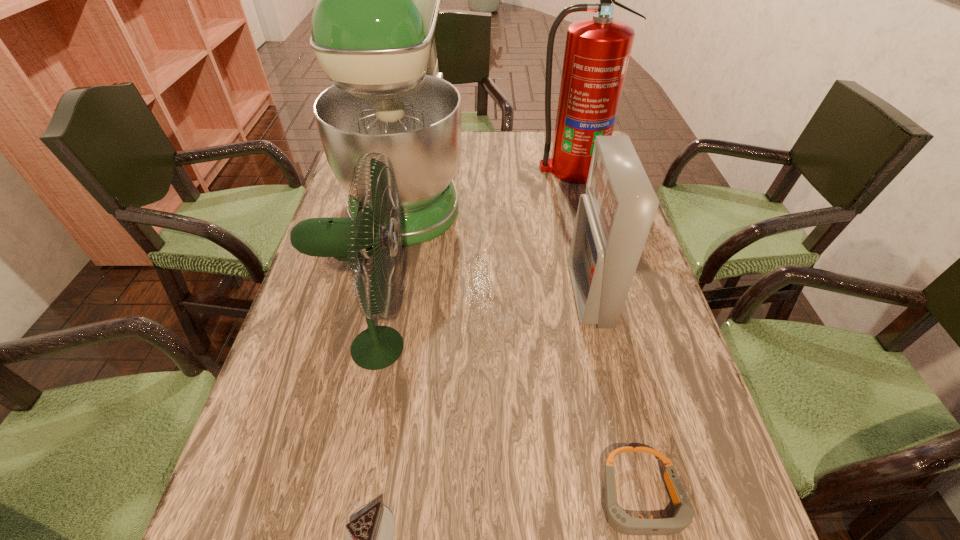
Locate an element on the screen. Image resolution: width=960 pixels, height=540 pixels. mixer that is positioned at the far edge is located at coordinates [373, 26].

This screenshot has width=960, height=540. What are the coordinates of `fire extinguisher that is at the far edge` in the screenshot? It's located at (597, 51).

The width and height of the screenshot is (960, 540). I want to click on mixer that is at the left edge, so click(373, 26).

Identify the location of fan situated at the left edge. (355, 239).

The height and width of the screenshot is (540, 960). Find the location of `fire extinguisher situated at the right edge`. fire extinguisher situated at the right edge is located at coordinates (597, 51).

Identify the location of the first-aid kit positioned at the right edge. The image size is (960, 540). (614, 217).

Image resolution: width=960 pixels, height=540 pixels. Identify the location of object that is positioned at the far left corner. (373, 26).

This screenshot has height=540, width=960. In order to click on object located in the far right corner section of the desktop in this screenshot , I will do `click(597, 51)`.

Where is `vacant space at the far edge`? The height and width of the screenshot is (540, 960). vacant space at the far edge is located at coordinates (508, 159).

In order to click on vacant space at the left edge of the desktop in this screenshot , I will do `click(313, 356)`.